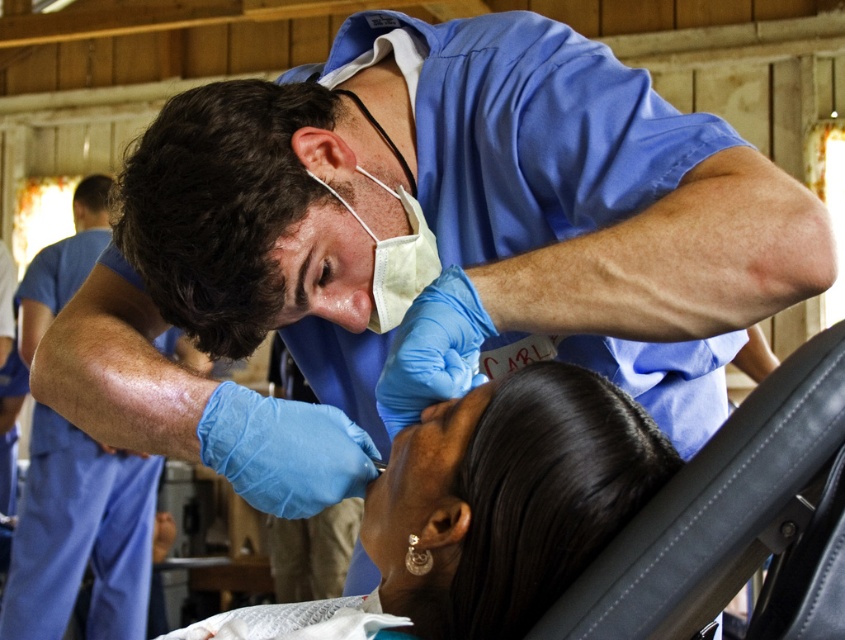
You are a dental assistant observing the scene. The dentist is wearing a white matte mask at upper center while examining the patient. The patient has a smooth skin face at center. Which object is taller in the image?

The smooth skin face at center is taller than the white matte mask at upper center.

You are a dental assistant observing the dentist and patient in the clinic. You need to check the position of the patient and the mask. Which object is located more to the right side between the smooth skin face at center and the white matte mask at upper center?

The smooth skin face at center is positioned on the right side of the white matte mask at upper center, so the smooth skin face at center is more to the right.

You are a dental assistant standing at the viewer position in the image. You need to hand the dentist a tool located at point (375, 600). Is the tool within your reach if your maximum reach is 4 feet?

The distance between you and the tool at point (375, 600) is 3.98 feet, which is within your maximum reach of 4 feet. Yes, you can reach it.